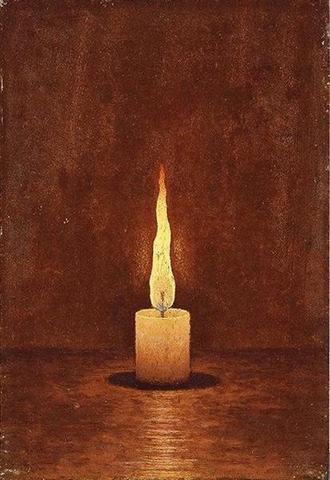
This screenshot has width=330, height=480. What are the coordinates of `top of candle` in the screenshot? It's located at (152, 312), (174, 312).